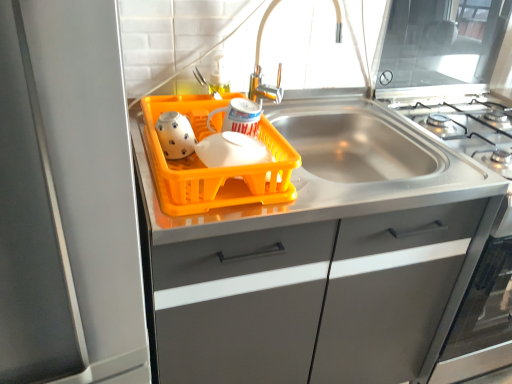
Where is `white glossy tea pot at center, the second tea pot in the left-to-right sequence`? The width and height of the screenshot is (512, 384). white glossy tea pot at center, the second tea pot in the left-to-right sequence is located at coordinates (232, 150).

Measure the distance between white glossy tea pot at left, the 1th tea pot in the left-to-right sequence, and camera.

white glossy tea pot at left, the 1th tea pot in the left-to-right sequence, is 34.09 inches from camera.

What do you see at coordinates (312, 298) in the screenshot? I see `matte gray cabinet at center` at bounding box center [312, 298].

Identify the location of matte gray cabinet at center. This screenshot has height=384, width=512. (312, 298).

This screenshot has width=512, height=384. In order to click on orange plastic basket at center in this screenshot , I will do `click(213, 168)`.

Image resolution: width=512 pixels, height=384 pixels. I want to click on white glossy tea pot at center, which ranks as the 1th tea pot in right-to-left order, so click(x=232, y=150).

Is matte gray cabinet at center bigger or smaller than satin silver refrigerator at left?

matte gray cabinet at center is smaller than satin silver refrigerator at left.

Which object is thinner, matte gray cabinet at center or satin silver refrigerator at left?

matte gray cabinet at center.

Which object is positioned more to the right, matte gray cabinet at center or satin silver refrigerator at left?

From the viewer's perspective, matte gray cabinet at center appears more on the right side.

Is matte gray cabinet at center oriented away from satin silver refrigerator at left?

matte gray cabinet at center does not have its back to satin silver refrigerator at left.

From the image's perspective, is metallic silver faucet at upper center under matte gray cabinet at center?

No, from the image's perspective, metallic silver faucet at upper center is not beneath matte gray cabinet at center.

This screenshot has height=384, width=512. Find the location of `faucet that appears on the right of matte gray cabinet at center`. faucet that appears on the right of matte gray cabinet at center is located at coordinates (261, 69).

How distant is metallic silver faucet at upper center from matte gray cabinet at center?

metallic silver faucet at upper center and matte gray cabinet at center are 63.38 centimeters apart from each other.

Does white glossy tea pot at center, the second tea pot in the left-to-right sequence, lie in front of metallic silver faucet at upper center?

Yes, it is.

Considering the sizes of objects white glossy tea pot at center, the second tea pot in the left-to-right sequence, and metallic silver faucet at upper center in the image provided, who is thinner, white glossy tea pot at center, the second tea pot in the left-to-right sequence, or metallic silver faucet at upper center?

white glossy tea pot at center, the second tea pot in the left-to-right sequence, is thinner.

Is white glossy tea pot at center, which ranks as the 1th tea pot in right-to-left order, spatially inside metallic silver faucet at upper center, or outside of it?

white glossy tea pot at center, which ranks as the 1th tea pot in right-to-left order, is located beyond the bounds of metallic silver faucet at upper center.

Is metallic silver faucet at upper center oriented away from white glossy tea pot at left, which is counted as the second tea pot, starting from the right?

No.

Does metallic silver faucet at upper center touch white glossy tea pot at left, which is counted as the second tea pot, starting from the right?

No, metallic silver faucet at upper center is not with white glossy tea pot at left, which is counted as the second tea pot, starting from the right.

Which of these two, metallic silver faucet at upper center or white glossy tea pot at left, which is counted as the second tea pot, starting from the right, stands taller?

With more height is metallic silver faucet at upper center.

Can you tell me how much metallic silver faucet at upper center and white glossy tea pot at left, which is counted as the second tea pot, starting from the right, differ in facing direction?

1.09 degrees separate the facing orientations of metallic silver faucet at upper center and white glossy tea pot at left, which is counted as the second tea pot, starting from the right.

Which of these two, orange plastic basket at center or metallic silver faucet at upper center, is bigger?

orange plastic basket at center is bigger.

From a real-world perspective, is orange plastic basket at center beneath metallic silver faucet at upper center?

Yes, from a real-world perspective, orange plastic basket at center is beneath metallic silver faucet at upper center.

Can you confirm if orange plastic basket at center is thinner than metallic silver faucet at upper center?

Incorrect, the width of orange plastic basket at center is not less than that of metallic silver faucet at upper center.

From the image's perspective, who appears lower, orange plastic basket at center or metallic silver faucet at upper center?

orange plastic basket at center is shown below in the image.

Looking at this image, does white glossy tea pot at center, the second tea pot in the left-to-right sequence, have a smaller size compared to matte gray cabinet at center?

Correct, white glossy tea pot at center, the second tea pot in the left-to-right sequence, occupies less space than matte gray cabinet at center.

In the scene shown: From a real-world perspective, is white glossy tea pot at center, which ranks as the 1th tea pot in right-to-left order, positioned over matte gray cabinet at center based on gravity?

Indeed, from a real-world perspective, white glossy tea pot at center, which ranks as the 1th tea pot in right-to-left order, stands above matte gray cabinet at center.

Based on the photo, which object is positioned more to the left, white glossy tea pot at center, the second tea pot in the left-to-right sequence, or matte gray cabinet at center?

From the viewer's perspective, white glossy tea pot at center, the second tea pot in the left-to-right sequence, appears more on the left side.

Is white glossy tea pot at left, which is counted as the second tea pot, starting from the right, looking in the opposite direction of orange plastic basket at center?

Yes, orange plastic basket at center is at the back of white glossy tea pot at left, which is counted as the second tea pot, starting from the right.

Which of these two, white glossy tea pot at left, which is counted as the second tea pot, starting from the right, or orange plastic basket at center, stands shorter?

Standing shorter between the two is white glossy tea pot at left, which is counted as the second tea pot, starting from the right.

Which of these two, white glossy tea pot at left, which is counted as the second tea pot, starting from the right, or orange plastic basket at center, is bigger?

orange plastic basket at center.

Which object is positioned more to the left, white glossy tea pot at left, which is counted as the second tea pot, starting from the right, or orange plastic basket at center?

From the viewer's perspective, white glossy tea pot at left, which is counted as the second tea pot, starting from the right, appears more on the left side.

Where is `appliance on the left of the matte gray cabinet at center`? Image resolution: width=512 pixels, height=384 pixels. appliance on the left of the matte gray cabinet at center is located at coordinates (67, 200).

Find the location of `faucet lying behind the matte gray cabinet at center`. faucet lying behind the matte gray cabinet at center is located at coordinates (261, 69).

Based on their spatial positions, is orange plastic basket at center or matte gray cabinet at center further from white glossy tea pot at left, which is counted as the second tea pot, starting from the right?

matte gray cabinet at center is positioned further to the anchor white glossy tea pot at left, which is counted as the second tea pot, starting from the right.

Looking at the image, which one is located closer to metallic silver faucet at upper center, satin silver refrigerator at left or white glossy tea pot at center, which ranks as the 1th tea pot in right-to-left order?

Based on the image, white glossy tea pot at center, which ranks as the 1th tea pot in right-to-left order, appears to be nearer to metallic silver faucet at upper center.

Based on their spatial positions, is white glossy tea pot at left, which is counted as the second tea pot, starting from the right, or metallic silver faucet at upper center further from orange plastic basket at center?

metallic silver faucet at upper center is positioned further to the anchor orange plastic basket at center.

When comparing their distances from metallic silver faucet at upper center, does white glossy tea pot at center, the second tea pot in the left-to-right sequence, or satin silver refrigerator at left seem closer?

The object closer to metallic silver faucet at upper center is white glossy tea pot at center, the second tea pot in the left-to-right sequence.

Looking at the image, which one is located further to white glossy tea pot at center, the second tea pot in the left-to-right sequence, satin silver refrigerator at left or white glossy tea pot at left, which is counted as the second tea pot, starting from the right?

Among the two, satin silver refrigerator at left is located further to white glossy tea pot at center, the second tea pot in the left-to-right sequence.

Looking at the image, which one is located closer to orange plastic basket at center, metallic silver faucet at upper center or matte gray cabinet at center?

Based on the image, matte gray cabinet at center appears to be nearer to orange plastic basket at center.

Looking at the image, which one is located further to white glossy tea pot at left, the 1th tea pot in the left-to-right sequence, matte gray cabinet at center or orange plastic basket at center?

matte gray cabinet at center.

Considering their positions, is metallic silver faucet at upper center positioned closer to satin silver refrigerator at left than orange plastic basket at center?

orange plastic basket at center lies closer to satin silver refrigerator at left than the other object.

I want to click on basket between white glossy tea pot at left, which is counted as the second tea pot, starting from the right, and white glossy tea pot at center, which ranks as the 1th tea pot in right-to-left order, in the horizontal direction, so click(x=213, y=168).

Where is `basket between metallic silver faucet at upper center and matte gray cabinet at center in the vertical direction`? basket between metallic silver faucet at upper center and matte gray cabinet at center in the vertical direction is located at coordinates (213, 168).

At what (x,y) coordinates should I click in order to perform the action: click on tea pot between metallic silver faucet at upper center and orange plastic basket at center in the up-down direction. Please return your answer as a coordinate pair (x, y). Looking at the image, I should click on (175, 135).

This screenshot has height=384, width=512. Find the location of `basket between satin silver refrigerator at left and metallic silver faucet at upper center in the front-back direction`. basket between satin silver refrigerator at left and metallic silver faucet at upper center in the front-back direction is located at coordinates (213, 168).